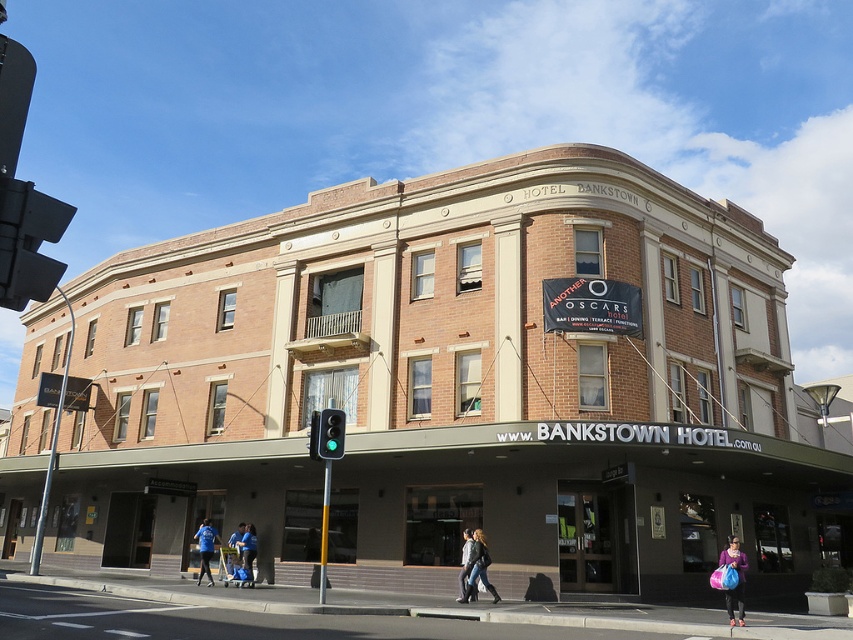
Question: Which object is the farthest from the blue fabric shirt at center?

Choices:
 (A) purple fabric bag at lower right
 (B) leather jacket at center
 (C) denim jacket at lower center

Answer: (A)

Question: Can you confirm if blue fabric shirt at lower center is smaller than blue fabric shirt at center?

Choices:
 (A) no
 (B) yes

Answer: (A)

Question: Is purple fabric bag at lower right to the left of blue fabric shirt at center from the viewer's perspective?

Choices:
 (A) no
 (B) yes

Answer: (A)

Question: Which object is the closest to the blue fabric shirt at center?

Choices:
 (A) concrete sidewalk at lower center
 (B) denim jacket at lower center
 (C) blue fabric shirt at lower center
 (D) blue fabric bag at lower center

Answer: (D)

Question: Can you confirm if blue fabric shirt at lower center is positioned below blue fabric shirt at center?

Choices:
 (A) no
 (B) yes

Answer: (A)

Question: Estimate the real-world distances between objects in this image. Which object is closer to the leather jacket at center?

Choices:
 (A) blue fabric shirt at center
 (B) blue fabric bag at lower center
 (C) blue fabric shirt at lower center

Answer: (A)